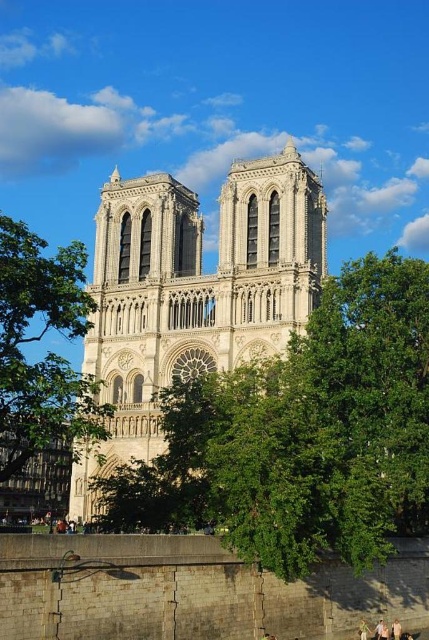
Is white stone tower at center smaller than light brown wooden chair at lower center?

Incorrect, white stone tower at center is not smaller in size than light brown wooden chair at lower center.

Does white stone tower at center appear over light brown wooden chair at lower center?

Indeed, white stone tower at center is positioned over light brown wooden chair at lower center.

Find the location of a particular element. The height and width of the screenshot is (640, 429). white stone tower at center is located at coordinates (193, 291).

Find the location of a particular element. white stone tower at center is located at coordinates (193, 291).

Which is behind, point (79, 394) or point (360, 621)?

Point (360, 621)

Between green leafy tree at left and light brown hair at lower center, which one is positioned higher?

green leafy tree at left

Is point (6, 266) more distant than point (360, 637)?

No, (6, 266) is in front of (360, 637).

Identify the location of green leafy tree at left. This screenshot has height=640, width=429. (47, 353).

Is point (377, 630) positioned in front of point (368, 628)?

Yes, point (377, 630) is closer to viewer.

Is light brown wooden chair at lower center shorter than light brown hair at lower center?

In fact, light brown wooden chair at lower center may be taller than light brown hair at lower center.

Is point (375, 637) positioned behind point (365, 632)?

Yes, point (375, 637) is farther from viewer.

At what (x,y) coordinates should I click in order to perform the action: click on light brown wooden chair at lower center. Please return your answer as a coordinate pair (x, y). The image size is (429, 640). Looking at the image, I should click on [380, 630].